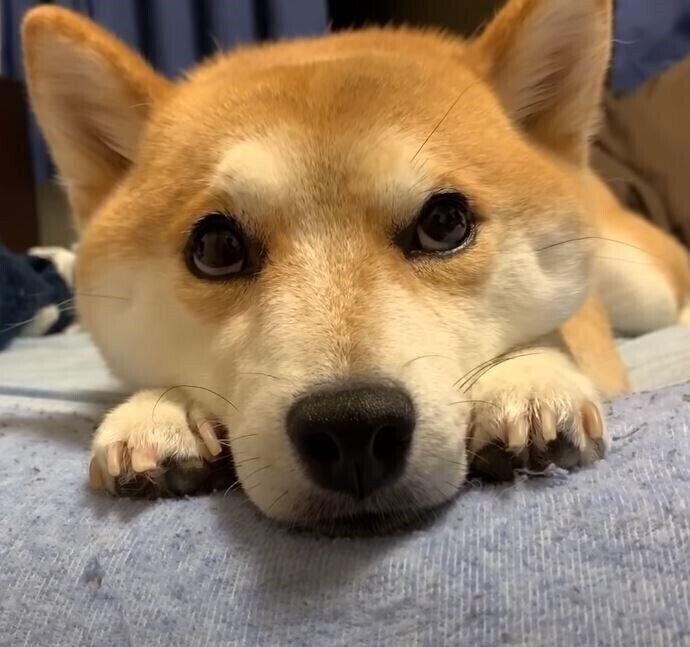
This screenshot has width=690, height=647. I want to click on blue cushion, so click(x=633, y=536).